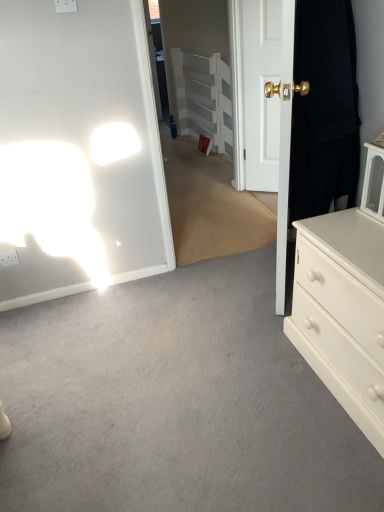
In order to click on vacant space in front of white painted wood armoire at center in this screenshot , I will do `click(192, 160)`.